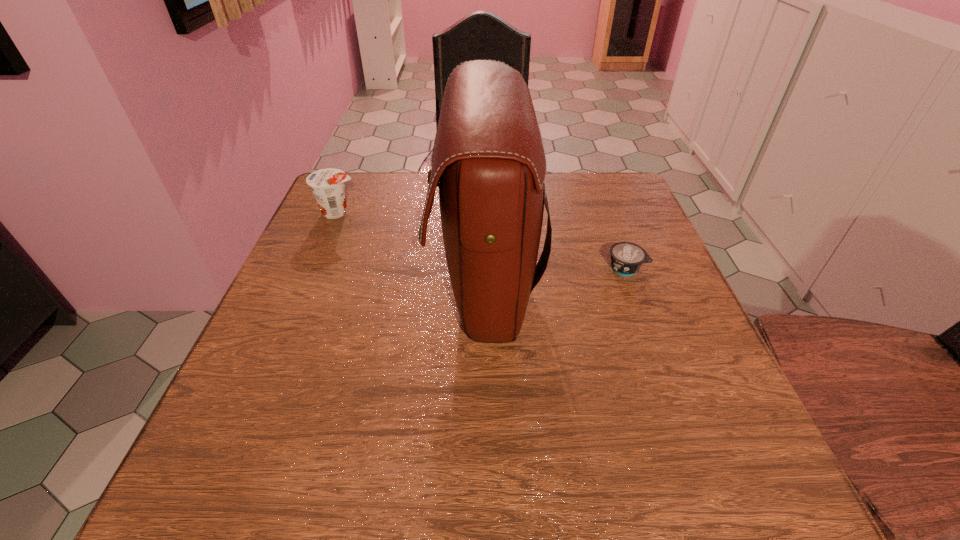
Where is `empty space that is in between the nearer yogurt and the second object from left to right`? empty space that is in between the nearer yogurt and the second object from left to right is located at coordinates (555, 276).

Identify which object is the closest to the tallest object. Please provide its 2D coordinates. Your answer should be formatted as a tuple, i.e. [(x, y)], where the tuple contains the x and y coordinates of a point satisfying the conditions above.

[(626, 258)]

You are a GUI agent. You are given a task and a screenshot of the screen. Output one action in this format:
    pyautogui.click(x=<x>, y=<y>)
    Task: Click on the object that can be found as the second closest to the satchel
    
    Given the screenshot: What is the action you would take?
    pyautogui.click(x=327, y=185)

At what (x,y) coordinates should I click in order to perform the action: click on free space that satisfies the following two spatial constraints: 1. on the front side of the right yogurt; 2. on the left side of the second tallest object. Please return your answer as a coordinate pair (x, y). The image size is (960, 540). Looking at the image, I should click on (314, 268).